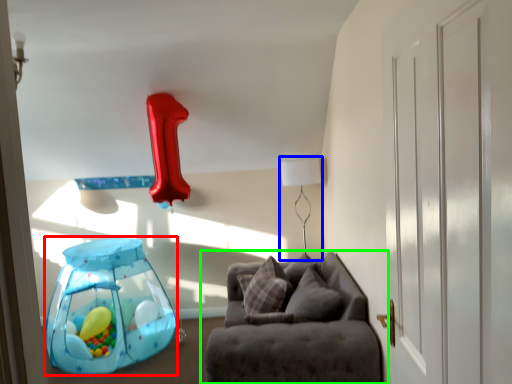
Question: Which object is positioned farthest from balloon (highlighted by a red box)? Select from table lamp (highlighted by a blue box) and studio couch (highlighted by a green box).

Choices:
 (A) table lamp
 (B) studio couch

Answer: (A)